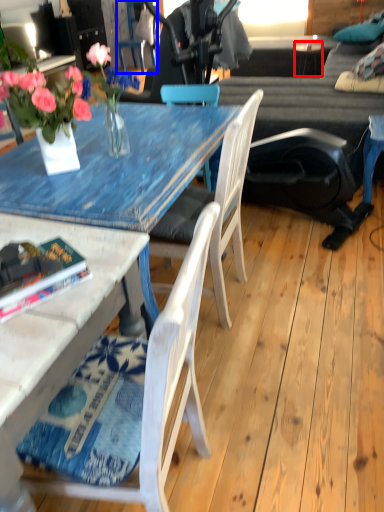
Question: Among these objects, which one is nearest to the camera, side table (highlighted by a red box) or chair (highlighted by a blue box)?

Choices:
 (A) side table
 (B) chair

Answer: (A)